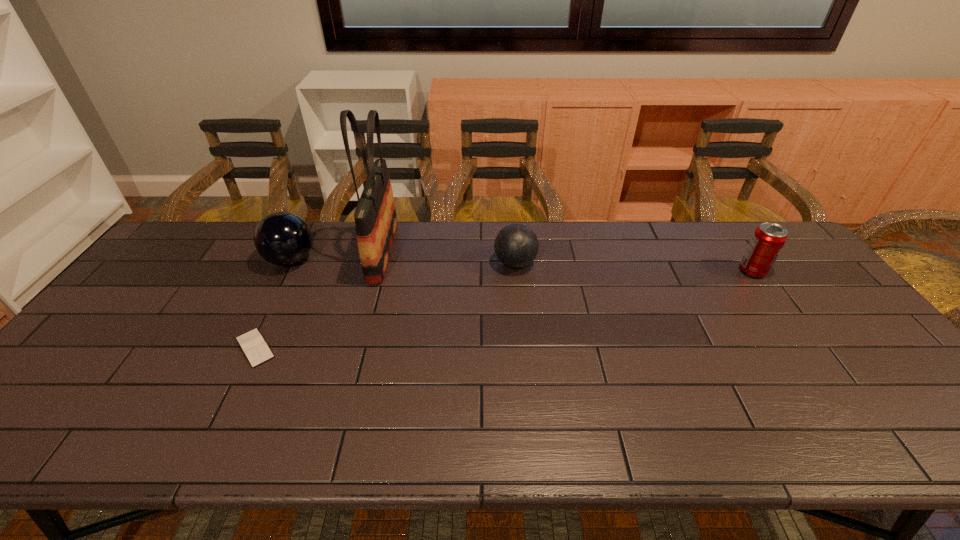
Locate an element on the screen. This screenshot has height=540, width=960. vacant space at the near edge of the desktop is located at coordinates (228, 439).

In the image, there is a desktop. At what (x,y) coordinates should I click in order to perform the action: click on vacant space at the left edge. Please return your answer as a coordinate pair (x, y). Looking at the image, I should click on (114, 319).

Find the location of a particular element. Image resolution: width=960 pixels, height=540 pixels. free location at the right edge is located at coordinates (879, 402).

The image size is (960, 540). In order to click on free space at the far left corner in this screenshot , I will do pyautogui.click(x=201, y=230).

I want to click on vacant space at the far right corner, so click(x=797, y=258).

Locate an element on the screen. This screenshot has width=960, height=540. empty location between the third object from left to right and the nearest object is located at coordinates (319, 300).

Identify the location of free space between the fourth object from left to right and the shortest object. (385, 306).

Where is `empty space between the left bowling ball and the third object from right to left`? empty space between the left bowling ball and the third object from right to left is located at coordinates (337, 256).

The height and width of the screenshot is (540, 960). Find the location of `free space between the right bowling ball and the soda can`. free space between the right bowling ball and the soda can is located at coordinates (634, 267).

The width and height of the screenshot is (960, 540). Identify the location of blank region between the shorter bowling ball and the shortest object. (385, 306).